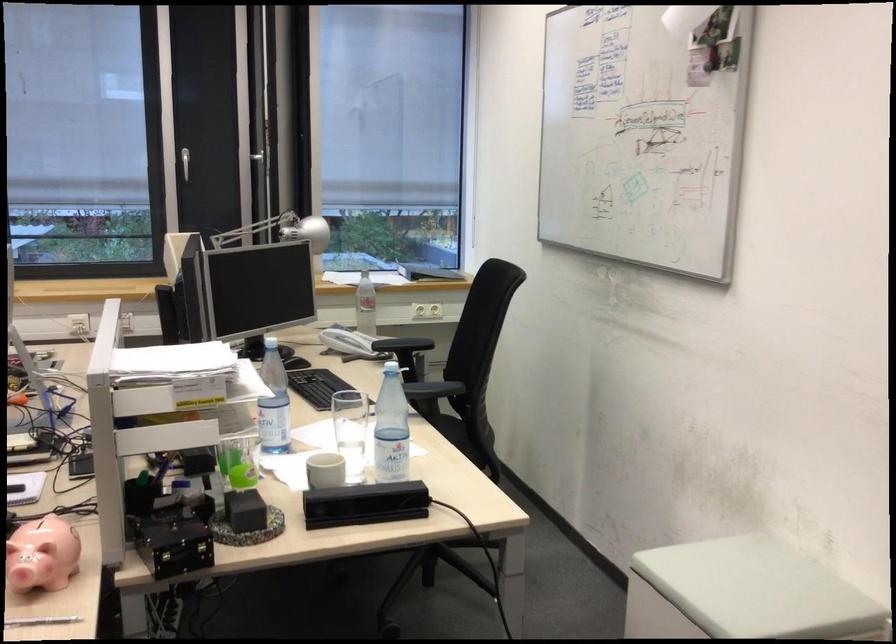
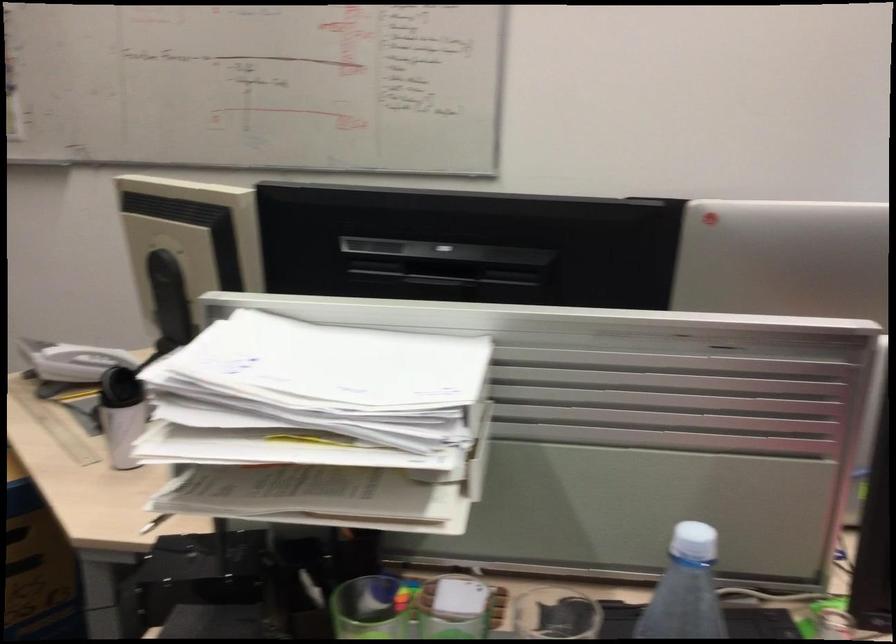
In the second image, find the point that corresponds to the point at 157,366 in the first image.

(333, 365)